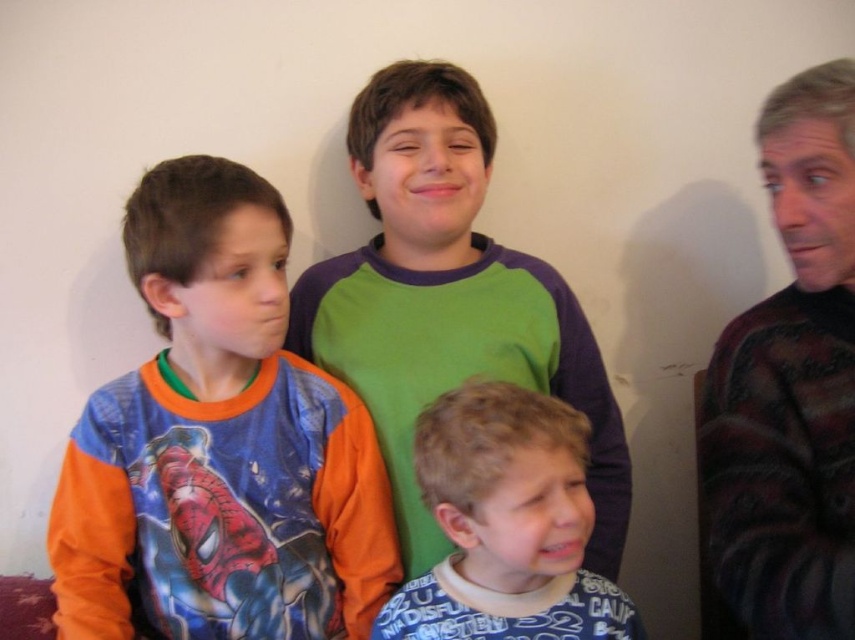
Can you confirm if dark maroon sweater at right is positioned below blue cotton shirt at lower center?

Incorrect, dark maroon sweater at right is not positioned below blue cotton shirt at lower center.

Between point (794, 368) and point (517, 612), which one is positioned in front?

Point (517, 612) is more forward.

This screenshot has width=855, height=640. I want to click on dark maroon sweater at right, so click(789, 385).

What are the coordinates of `dark maroon sweater at right` in the screenshot? It's located at (789, 385).

How distant is matte orange long-sleeve shirt at left from dark maroon sweater at right?

matte orange long-sleeve shirt at left and dark maroon sweater at right are 22.71 inches apart from each other.

Between matte orange long-sleeve shirt at left and dark maroon sweater at right, which one appears on the left side from the viewer's perspective?

matte orange long-sleeve shirt at left is more to the left.

Is point (201, 336) more distant than point (711, 380)?

No.

The width and height of the screenshot is (855, 640). Find the location of `matte orange long-sleeve shirt at left`. matte orange long-sleeve shirt at left is located at coordinates (219, 444).

Which is more to the right, green soft shirt at center or dark maroon sweater at right?

Positioned to the right is dark maroon sweater at right.

Is green soft shirt at center thinner than dark maroon sweater at right?

Incorrect, green soft shirt at center's width is not less than dark maroon sweater at right's.

What do you see at coordinates (447, 298) in the screenshot? I see `green soft shirt at center` at bounding box center [447, 298].

Identify the location of green soft shirt at center. (447, 298).